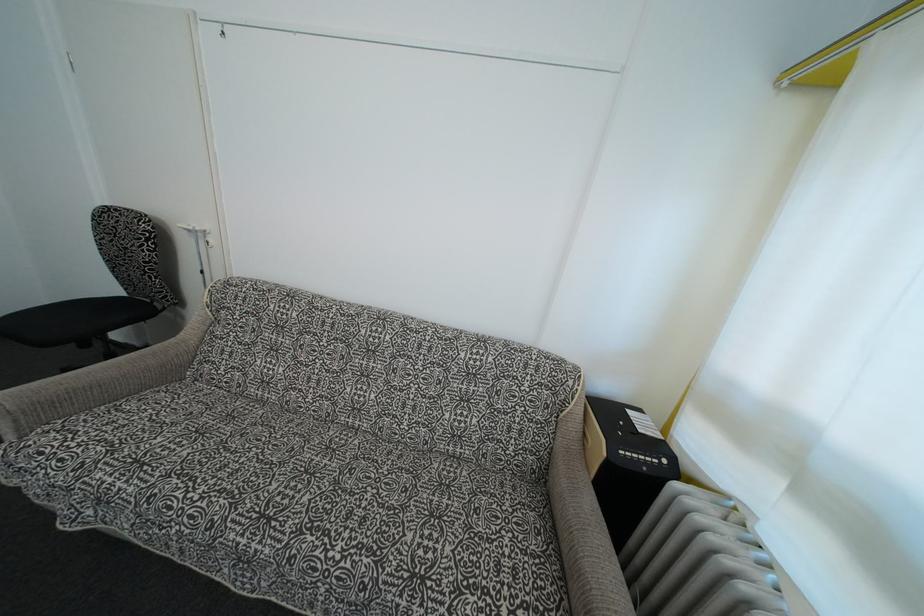
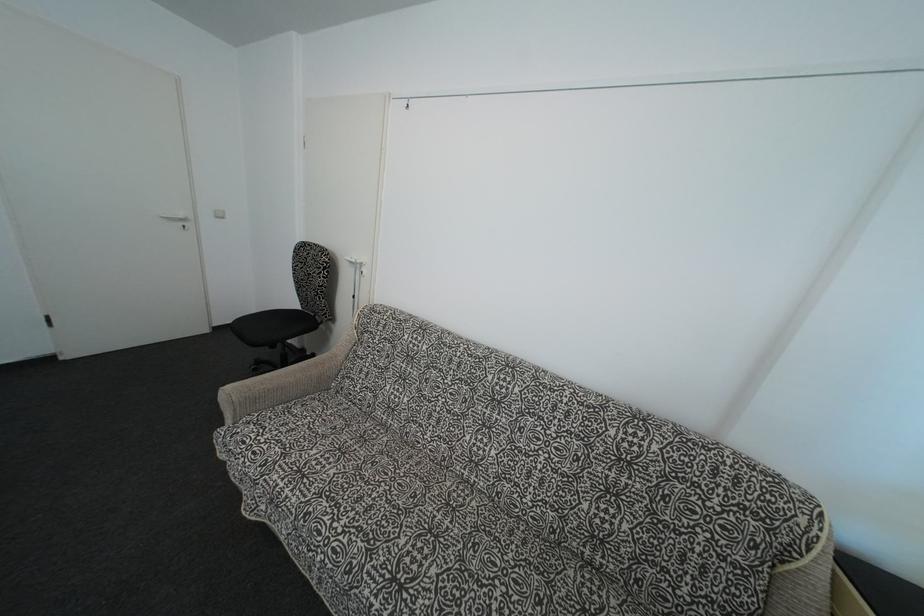
Locate, in the second image, the point that corresponds to the point at 254,524 in the first image.

(387, 583)